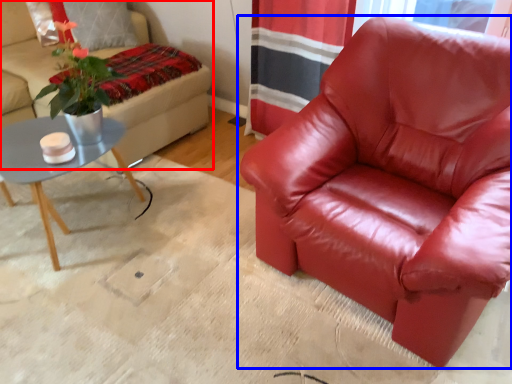
Question: Which of the following is the farthest to the observer, studio couch (highlighted by a red box) or chair (highlighted by a blue box)?

Choices:
 (A) studio couch
 (B) chair

Answer: (A)